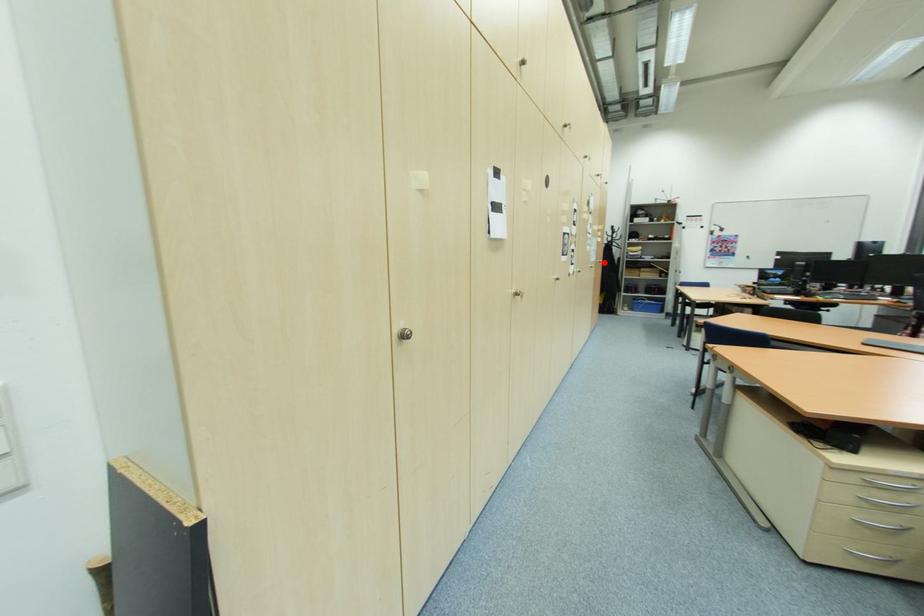
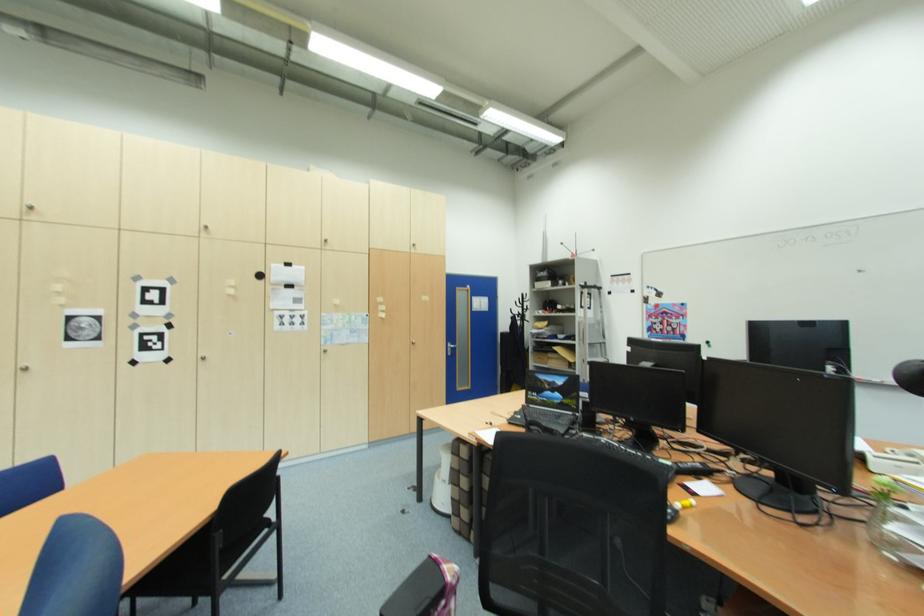
Find the pixel in the second image that matches the highlighted location in the first image.

(418, 345)